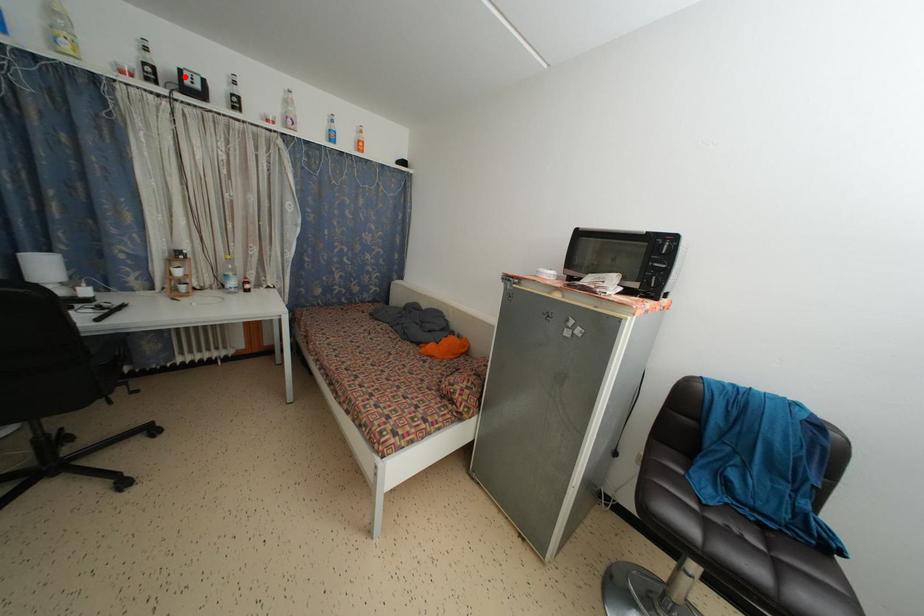
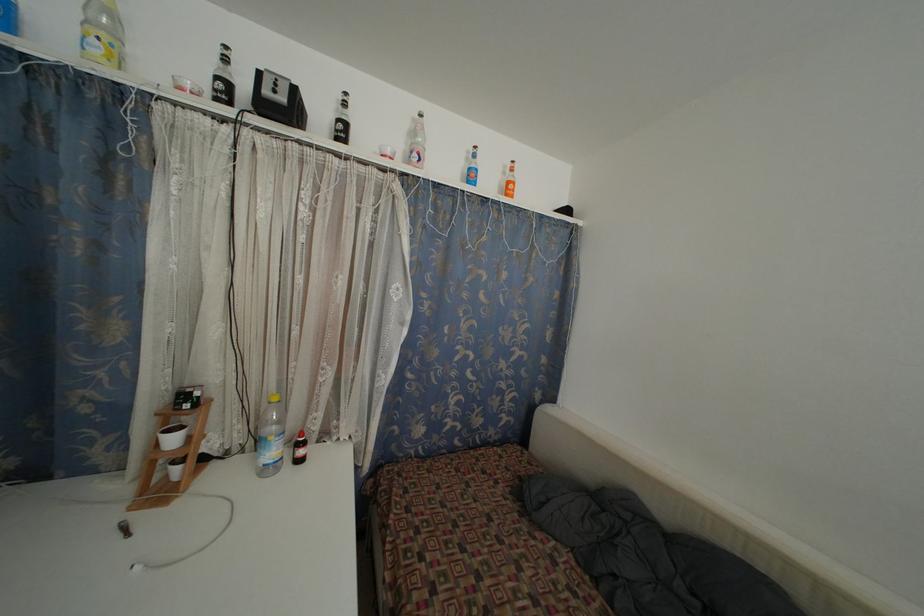
Find the pixel in the second image that matches the highlighted location in the first image.

(263, 79)